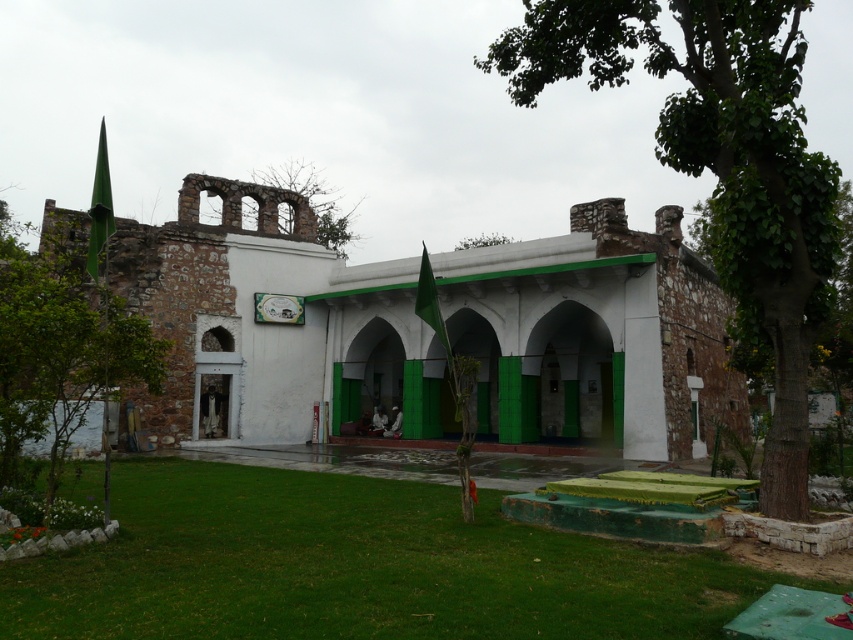
Question: Is green grass at lower center positioned at the back of bare branches at upper center?

Choices:
 (A) yes
 (B) no

Answer: (B)

Question: Which of the following is the closest to the observer?

Choices:
 (A) green grass at lower center
 (B) green leafy tree at upper center

Answer: (A)

Question: In this image, where is white stone mosque at center located relative to green leafy tree at center?

Choices:
 (A) below
 (B) above

Answer: (A)

Question: Is white stone mosque at center to the right of bare branches at upper center from the viewer's perspective?

Choices:
 (A) yes
 (B) no

Answer: (A)

Question: Which is farther from the green leafy tree at center?

Choices:
 (A) white stone mosque at center
 (B) green leafy tree at left
 (C) green leafy tree at upper center
 (D) green grass at lower center

Answer: (C)

Question: Among these points, which one is nearest to the camera?

Choices:
 (A) (520, 353)
 (B) (253, 170)
 (C) (183, 502)
 (D) (22, 259)

Answer: (C)